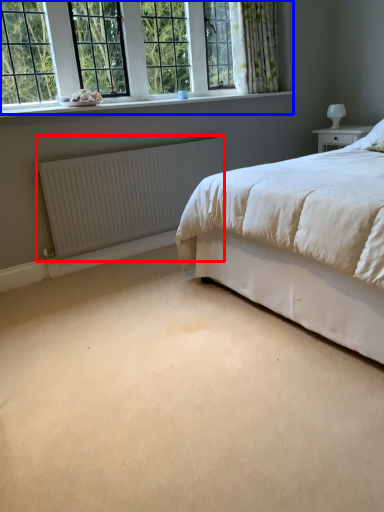
Question: Which point is further to the camera, radiator (highlighted by a red box) or window (highlighted by a blue box)?

Choices:
 (A) radiator
 (B) window

Answer: (A)